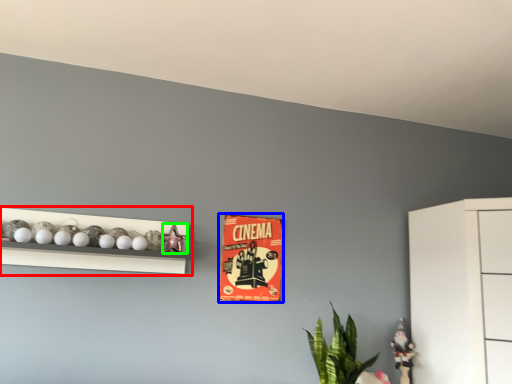
Question: Which object is positioned farthest from shelf (highlighted by a red box)? Select from postcard (highlighted by a blue box) and toy (highlighted by a green box).

Choices:
 (A) postcard
 (B) toy

Answer: (A)